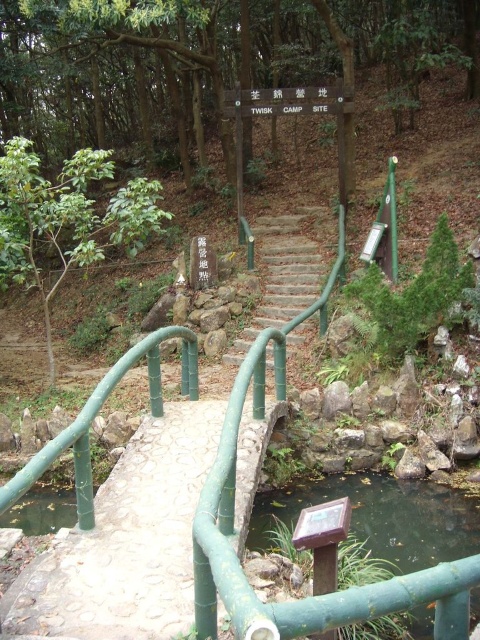
You are a hiker who wants to cross the green bamboo stream at lower center to reach the green bamboo stairs at center. Based on the scene, can you determine if the stream is directly under the stairs?

The green bamboo stream at lower center is located below the green bamboo stairs at center, so yes, the stream is directly under the stairs, allowing you to cross it to reach the stairs.

You are a hiker carrying a 2.5 meter long bamboo pole. You need to move from the green bamboo stream at lower center to the green bamboo stairs at center. Can you move the pole horizontally without tilting it? Please explain your reasoning.

The distance between the green bamboo stream at lower center and the green bamboo stairs at center is 3.83 meters. Since the pole is 2.5 meters long, which is shorter than the distance between them, you can move the pole horizontally without tilting it.